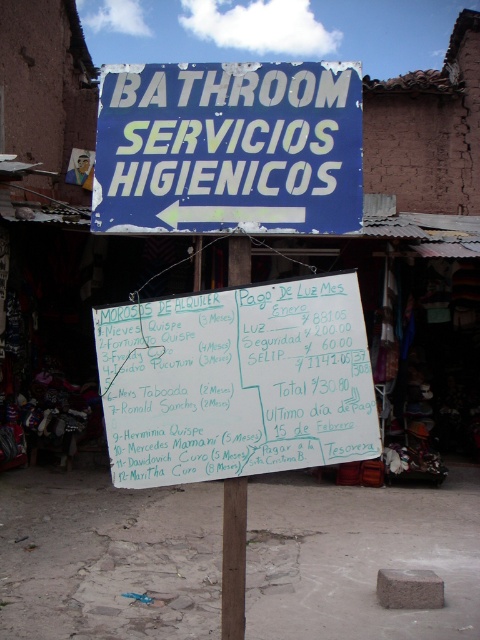
Question: Based on their relative distances, which object is farther from the green paperboard at center?

Choices:
 (A) white paper sign at center
 (B) blue painted board at upper center

Answer: (B)

Question: Is green paperboard at center positioned before blue painted board at upper center?

Choices:
 (A) no
 (B) yes

Answer: (A)

Question: Can you confirm if green paperboard at center is smaller than white paper sign at center?

Choices:
 (A) yes
 (B) no

Answer: (B)

Question: Which object is the farthest from the blue painted board at upper center?

Choices:
 (A) green paperboard at center
 (B) white paper sign at center

Answer: (B)

Question: Does blue painted board at upper center appear on the left side of white paper sign at center?

Choices:
 (A) no
 (B) yes

Answer: (B)

Question: Which of the following is the farthest from the observer?

Choices:
 (A) (170, 145)
 (B) (117, 444)

Answer: (A)